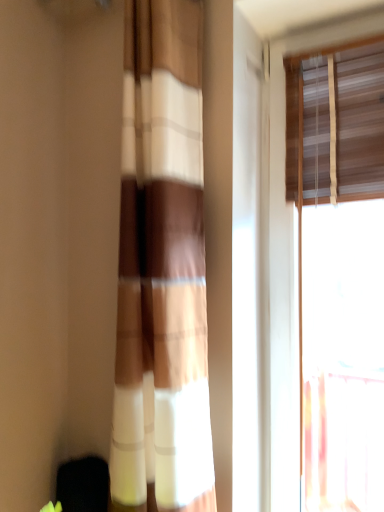
This screenshot has height=512, width=384. In order to click on wooden blinds at upper right in this screenshot , I will do `click(333, 141)`.

What do you see at coordinates (333, 141) in the screenshot? I see `wooden blinds at upper right` at bounding box center [333, 141].

What is the approximate width of brown textured curtain at center?

The width of brown textured curtain at center is 15.02 inches.

You are a GUI agent. You are given a task and a screenshot of the screen. Output one action in this format:
    pyautogui.click(x=<x>, y=<y>)
    Task: Click on the brown textured curtain at center
    
    Given the screenshot: What is the action you would take?
    [162, 263]

What is the approximate height of brown textured curtain at center?

brown textured curtain at center is 1.28 meters in height.

Describe the element at coordinates (162, 263) in the screenshot. I see `brown textured curtain at center` at that location.

You are a GUI agent. You are given a task and a screenshot of the screen. Output one action in this format:
    pyautogui.click(x=<x>, y=<y>)
    Task: Click on the wooden blinds at upper right
    The image size is (384, 512).
    Given the screenshot: What is the action you would take?
    (x=333, y=141)

Considering the relative positions of brown textured curtain at center and wooden blinds at upper right in the image provided, is brown textured curtain at center to the left of wooden blinds at upper right from the viewer's perspective?

Yes.

In the image, is brown textured curtain at center positioned in front of or behind wooden blinds at upper right?

brown textured curtain at center is positioned closer to the viewer than wooden blinds at upper right.

Considering the positions of point (165, 147) and point (287, 93), is point (165, 147) closer or farther from the camera than point (287, 93)?

Point (165, 147) appears to be closer to the viewer than point (287, 93).

From the image's perspective, is brown textured curtain at center on wooden blinds at upper right?

Yes, from the image's perspective, brown textured curtain at center is over wooden blinds at upper right.

From a real-world perspective, is brown textured curtain at center above or below wooden blinds at upper right?

brown textured curtain at center is situated higher than wooden blinds at upper right in the real world.

Considering the sizes of objects brown textured curtain at center and wooden blinds at upper right in the image provided, who is wider, brown textured curtain at center or wooden blinds at upper right?

brown textured curtain at center.

In terms of height, does brown textured curtain at center look taller or shorter compared to wooden blinds at upper right?

Clearly, brown textured curtain at center is shorter compared to wooden blinds at upper right.

Is brown textured curtain at center bigger than wooden blinds at upper right?

Indeed, brown textured curtain at center has a larger size compared to wooden blinds at upper right.

Choose the correct answer: Is brown textured curtain at center inside wooden blinds at upper right or outside it?

brown textured curtain at center cannot be found inside wooden blinds at upper right.

Is the surface of brown textured curtain at center in direct contact with wooden blinds at upper right?

No, brown textured curtain at center is not touching wooden blinds at upper right.

Could you tell me if brown textured curtain at center is turned towards wooden blinds at upper right?

No, brown textured curtain at center is not aimed at wooden blinds at upper right.

What's the angular difference between brown textured curtain at center and wooden blinds at upper right's facing directions?

The angular difference between brown textured curtain at center and wooden blinds at upper right is 0.0788 degrees.

How much distance is there between brown textured curtain at center and wooden blinds at upper right?

brown textured curtain at center and wooden blinds at upper right are 14.30 inches apart.

Where is `curtain on the left of wooden blinds at upper right`? curtain on the left of wooden blinds at upper right is located at coordinates (162, 263).

Which is more to the left, wooden blinds at upper right or brown textured curtain at center?

brown textured curtain at center.

Is wooden blinds at upper right positioned before brown textured curtain at center?

→ No, wooden blinds at upper right is further to the viewer.

Does point (302, 466) appear closer or farther from the camera than point (126, 202)?

Point (302, 466) is farther from the camera than point (126, 202).

From the image's perspective, is wooden blinds at upper right under brown textured curtain at center?

Yes, from the image's perspective, wooden blinds at upper right is below brown textured curtain at center.

From a real-world perspective, is wooden blinds at upper right beneath brown textured curtain at center?

Correct, in the physical world, wooden blinds at upper right is lower than brown textured curtain at center.

Which object is wider, wooden blinds at upper right or brown textured curtain at center?

brown textured curtain at center.

Between wooden blinds at upper right and brown textured curtain at center, which one has less height?

brown textured curtain at center is shorter.

Looking at the image, does wooden blinds at upper right seem bigger or smaller compared to brown textured curtain at center?

Considering their sizes, wooden blinds at upper right takes up less space than brown textured curtain at center.

Could brown textured curtain at center be considered to be inside wooden blinds at upper right?

That's incorrect, brown textured curtain at center is not inside wooden blinds at upper right.

Is wooden blinds at upper right next to brown textured curtain at center?

No, wooden blinds at upper right is not with brown textured curtain at center.

In the scene shown: Is wooden blinds at upper right facing away from brown textured curtain at center?

wooden blinds at upper right does not have its back to brown textured curtain at center.

Locate an element on the screen. This screenshot has height=512, width=384. curtain on the left side of wooden blinds at upper right is located at coordinates (162, 263).

This screenshot has height=512, width=384. Identify the location of window below the brown textured curtain at center (from a real-world perspective). (333, 141).

This screenshot has width=384, height=512. Find the location of `window lying behind the brown textured curtain at center`. window lying behind the brown textured curtain at center is located at coordinates (333, 141).